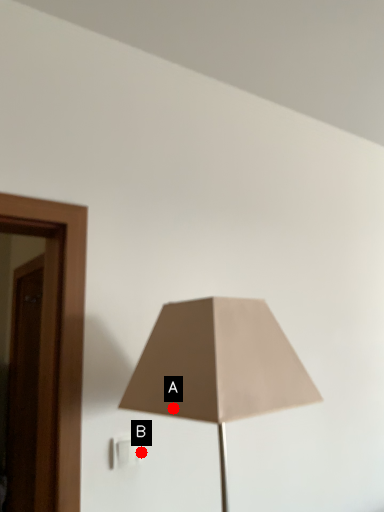
Question: Two points are circled on the image, labeled by A and B beside each circle. Which point is farther from the camera taking this photo?

Choices:
 (A) A is further
 (B) B is further

Answer: (B)